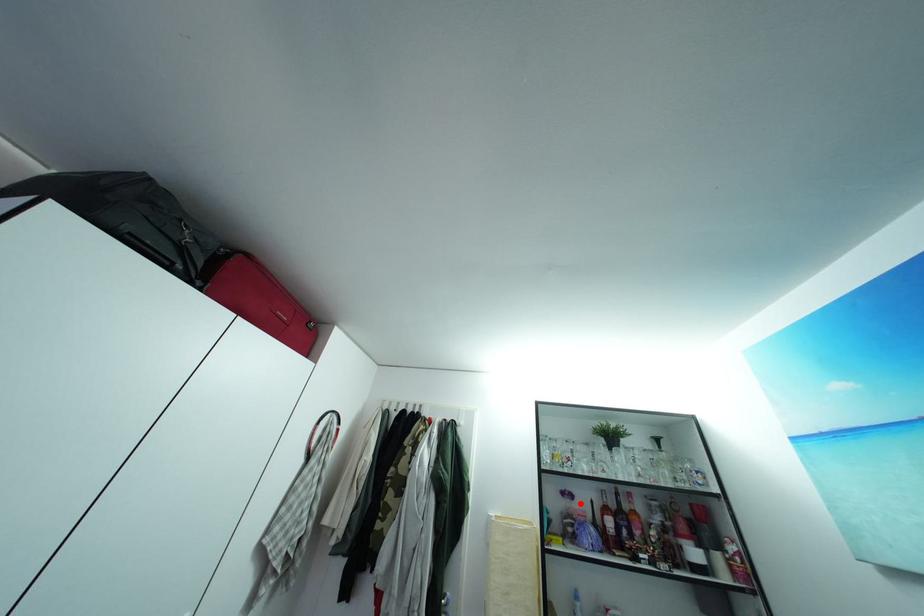
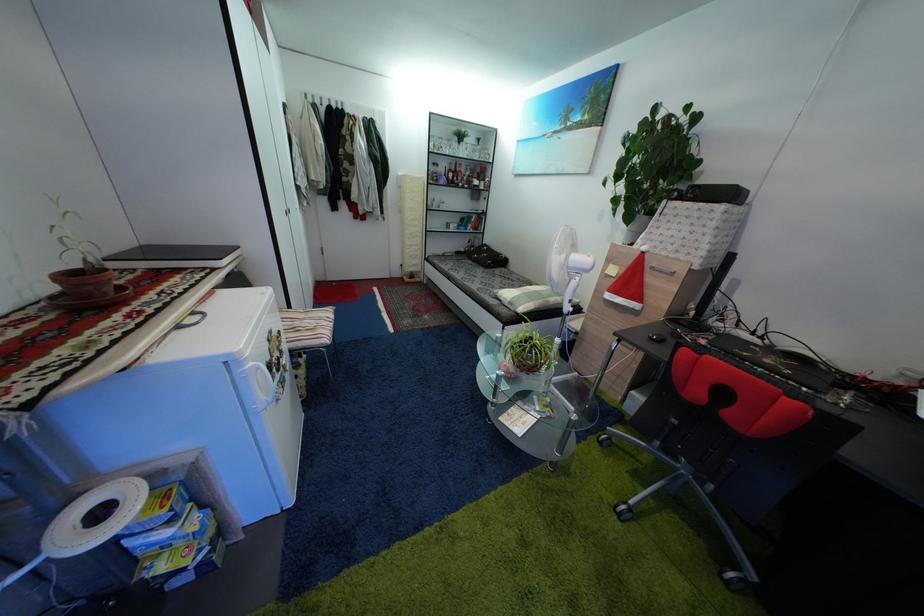
Question: I am providing you with two images of the same scene from different viewpoints. Given a red point in image1, look at the same physical point in image2. Is it:

Choices:
 (A) Closer to the viewpoint
 (B) Farther from the viewpoint

Answer: (A)